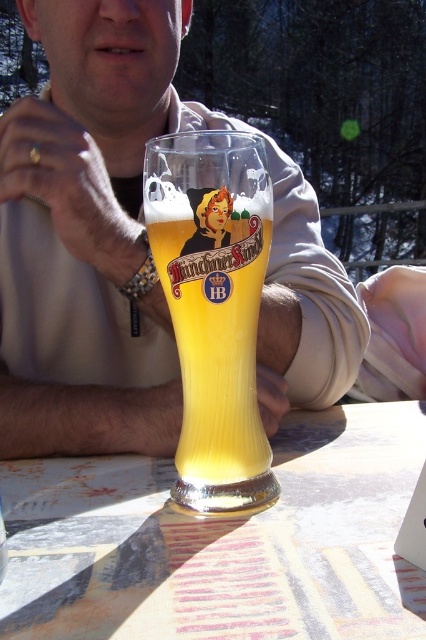
Question: Which of these objects is positioned closest to the translucent glass table at center?

Choices:
 (A) translucent glass beer glass at center
 (B) matte glass beer at center

Answer: (A)

Question: Which object is the closest to the translucent glass beer glass at center?

Choices:
 (A) matte glass beer at center
 (B) translucent glass table at center

Answer: (B)

Question: Does matte glass beer at center lie behind translucent glass table at center?

Choices:
 (A) yes
 (B) no

Answer: (A)

Question: Can you confirm if translucent glass table at center is bigger than translucent glass beer glass at center?

Choices:
 (A) yes
 (B) no

Answer: (A)

Question: Which is farther from the translucent glass beer glass at center?

Choices:
 (A) matte glass beer at center
 (B) translucent glass table at center

Answer: (A)

Question: Considering the relative positions of matte glass beer at center and translucent glass beer glass at center in the image provided, where is matte glass beer at center located with respect to translucent glass beer glass at center?

Choices:
 (A) left
 (B) right

Answer: (A)